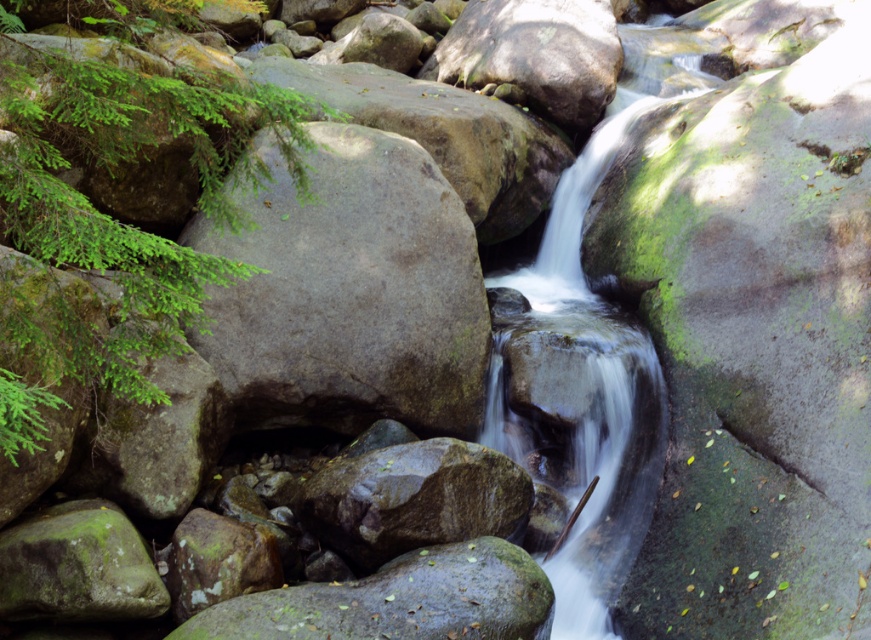
You are standing at the camera position and want to cross the stream. The clear water at center is where the stream flows fastest. If you can jump 25 feet, can you jump across the stream from where you are standing?

The distance between you and the clear water at center is 28.44 feet. Since your jump can only reach 25 feet, you cannot jump across the stream from where you are standing.

You are a hiker trying to cross the stream. You see the clear water at center and the green mossy rock at center. Which one is a safer stepping stone for you to step on?

The green mossy rock at center is a safer stepping stone because it is larger in size compared to the clear water at center, which is smaller and may not provide stable footing.